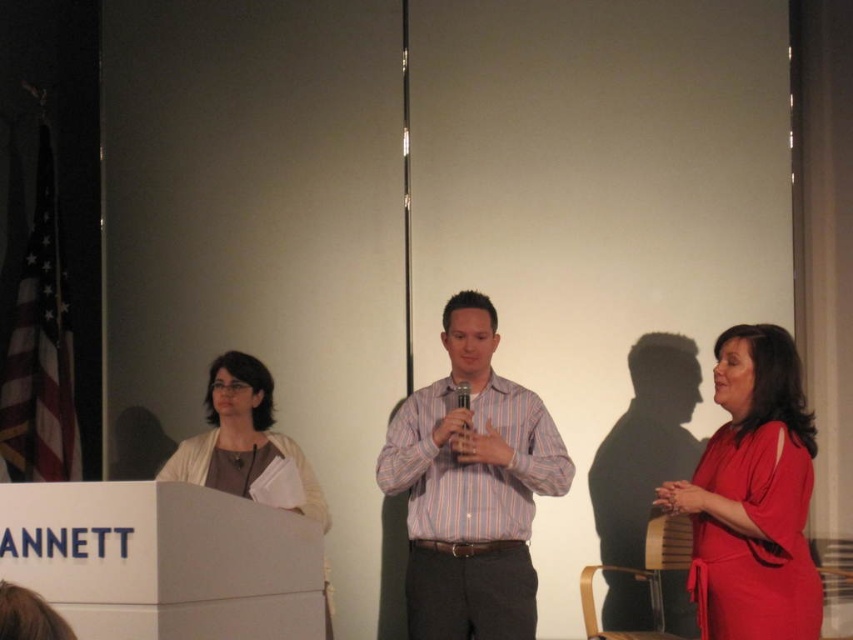
Question: Does striped cotton shirt at center appear on the right side of matte red dress at right?

Choices:
 (A) no
 (B) yes

Answer: (A)

Question: Which point appears farthest from the camera in this image?

Choices:
 (A) (691, 600)
 (B) (445, 323)
 (C) (271, 452)

Answer: (B)

Question: From the image, what is the correct spatial relationship of striped cotton shirt at center in relation to matte red dress at right?

Choices:
 (A) above
 (B) below

Answer: (A)

Question: Where is striped cotton shirt at center located in relation to matte white blouse at center in the image?

Choices:
 (A) right
 (B) left

Answer: (A)

Question: Which object appears farthest from the camera in this image?

Choices:
 (A) matte red dress at right
 (B) matte white blouse at center
 (C) striped cotton shirt at center

Answer: (C)

Question: Which of the following is the closest to the observer?

Choices:
 (A) (569, 464)
 (B) (207, 445)
 (C) (805, 420)

Answer: (C)